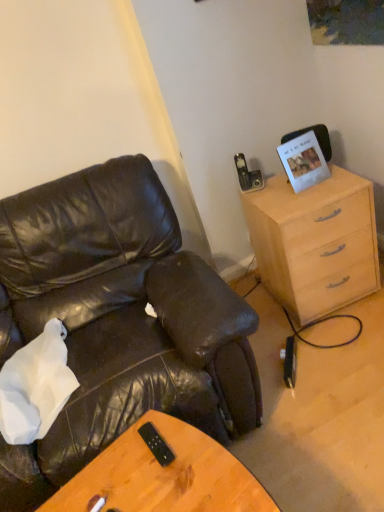
Question: Considering the relative sizes of white paper picture frame at upper right and light wood/finish cabinet at right in the image provided, is white paper picture frame at upper right wider than light wood/finish cabinet at right?

Choices:
 (A) no
 (B) yes

Answer: (A)

Question: Is white paper picture frame at upper right behind light wood/finish cabinet at right?

Choices:
 (A) yes
 (B) no

Answer: (A)

Question: Is white paper picture frame at upper right located outside light wood/finish cabinet at right?

Choices:
 (A) no
 (B) yes

Answer: (B)

Question: Does white paper picture frame at upper right appear on the left side of light wood/finish cabinet at right?

Choices:
 (A) no
 (B) yes

Answer: (B)

Question: Can you confirm if white paper picture frame at upper right is taller than light wood/finish cabinet at right?

Choices:
 (A) yes
 (B) no

Answer: (B)

Question: Is white paper picture frame at upper right far away from light wood/finish cabinet at right?

Choices:
 (A) no
 (B) yes

Answer: (A)

Question: Is white paper picture frame at upper right oriented away from matte black leather chair at left?

Choices:
 (A) yes
 (B) no

Answer: (B)

Question: Can you confirm if white paper picture frame at upper right is bigger than matte black leather chair at left?

Choices:
 (A) no
 (B) yes

Answer: (A)

Question: Considering the relative sizes of white paper picture frame at upper right and matte black leather chair at left in the image provided, is white paper picture frame at upper right shorter than matte black leather chair at left?

Choices:
 (A) yes
 (B) no

Answer: (A)

Question: Considering the relative positions of white paper picture frame at upper right and matte black leather chair at left in the image provided, is white paper picture frame at upper right to the left of matte black leather chair at left from the viewer's perspective?

Choices:
 (A) yes
 (B) no

Answer: (B)

Question: Is white paper picture frame at upper right thinner than matte black leather chair at left?

Choices:
 (A) no
 (B) yes

Answer: (B)

Question: Is white paper picture frame at upper right located outside matte black leather chair at left?

Choices:
 (A) no
 (B) yes

Answer: (B)

Question: Considering the relative positions of black plastic remote at center and white paper picture frame at upper right in the image provided, is black plastic remote at center to the right of white paper picture frame at upper right from the viewer's perspective?

Choices:
 (A) yes
 (B) no

Answer: (B)